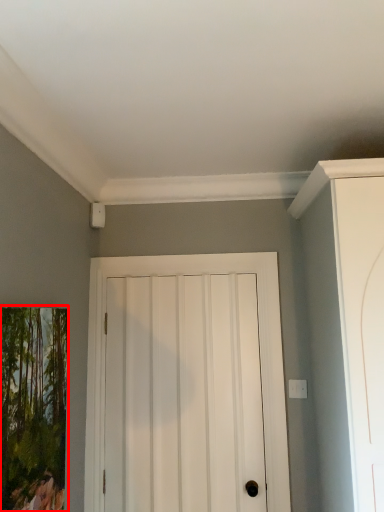
Question: From the image's perspective, considering the relative positions of picture frame (annotated by the red box) and door in the image provided, where is picture frame (annotated by the red box) located with respect to the staircase?

Choices:
 (A) above
 (B) below

Answer: (A)